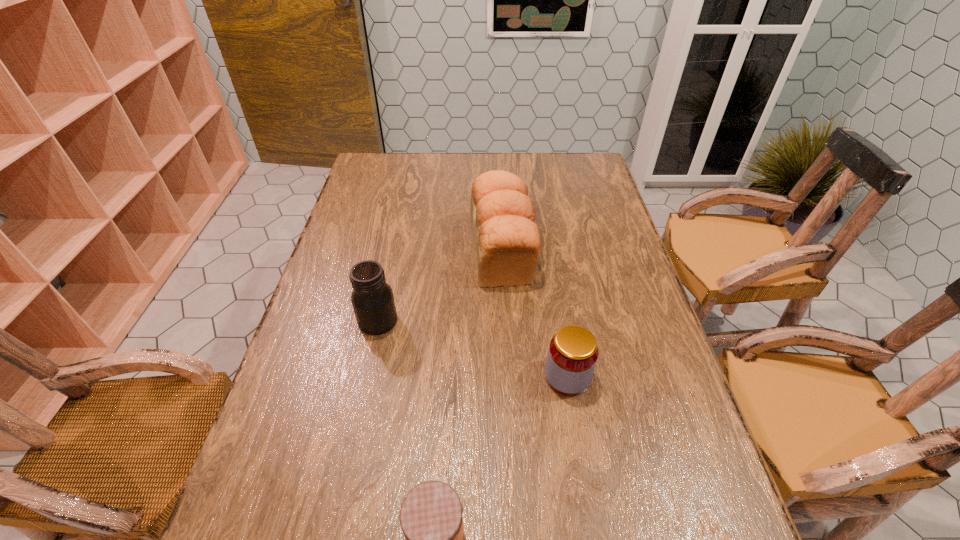
At what (x,y) coordinates should I click in order to perform the action: click on vacant space at the left edge of the desktop. Please return your answer as a coordinate pair (x, y). This screenshot has width=960, height=540. Looking at the image, I should click on 373,187.

Locate an element on the screen. This screenshot has height=540, width=960. vacant space at the right edge is located at coordinates (611, 389).

At what (x,y) coordinates should I click in order to perform the action: click on free space at the far left corner of the desktop. Please return your answer as a coordinate pair (x, y). Looking at the image, I should click on (361, 166).

Find the location of a particular element. The image size is (960, 540). empty location between the bread and the second farthest jar is located at coordinates (535, 314).

At what (x,y) coordinates should I click in order to perform the action: click on vacant area that lies between the rightmost jar and the leftmost object. Please return your answer as a coordinate pair (x, y). The height and width of the screenshot is (540, 960). Looking at the image, I should click on (472, 349).

Locate an element on the screen. This screenshot has width=960, height=540. unoccupied position between the second farthest jar and the bread is located at coordinates (535, 314).

In order to click on vacant space in between the second nearest jar and the third nearest object in this screenshot , I will do `click(472, 349)`.

At what (x,y) coordinates should I click in order to perform the action: click on free space between the leftmost jar and the second farthest jar. Please return your answer as a coordinate pair (x, y). This screenshot has width=960, height=540. Looking at the image, I should click on (472, 349).

Locate an element on the screen. The width and height of the screenshot is (960, 540). object that is the third closest to the bread is located at coordinates (431, 518).

Locate which object ranks second in proximity to the nearest object. Please provide its 2D coordinates. Your answer should be formatted as a tuple, i.e. [(x, y)], where the tuple contains the x and y coordinates of a point satisfying the conditions above.

[(372, 299)]